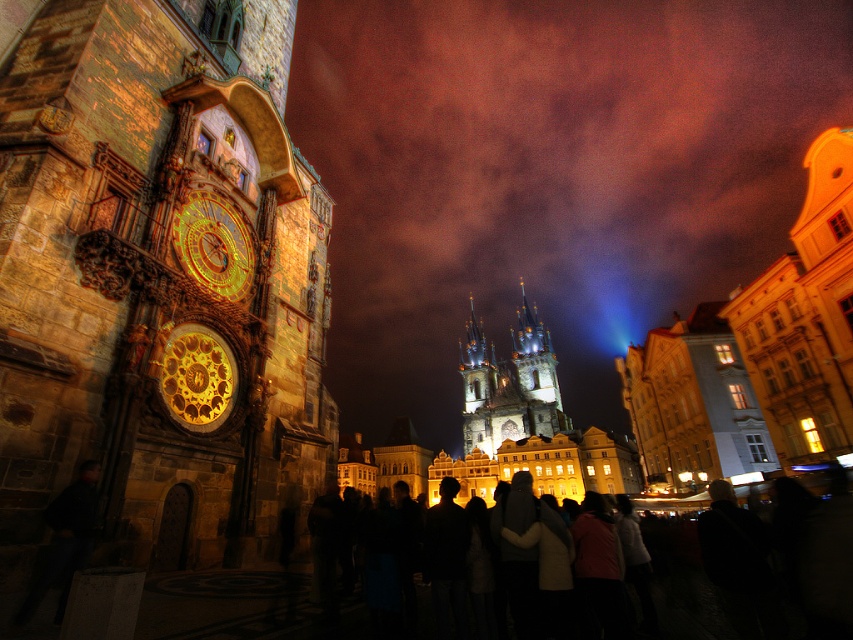
You are standing in the square and want to take a photo of both the white stone bell tower at center and the golden polished metal clock at left. Based on their positions, which one should you position on the left side of your camera frame?

The golden polished metal clock at left should be positioned on the left side of your camera frame since the white stone bell tower at center is to the right of it.

You are standing in the square and want to take a photo of the golden polished metal clock at left. Where should you position yourself to capture it in the frame?

To capture the golden polished metal clock at left in your photo, position yourself so that the clock is centered at the coordinates corresponding to point 0.589 on the horizontal axis and 0.232 on the vertical axis.